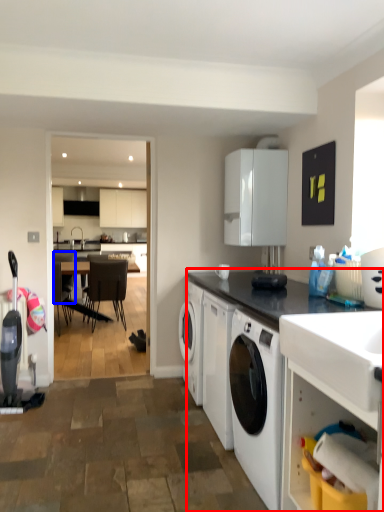
Question: Which object appears farthest to the camera in this image, countertop (highlighted by a red box) or chair (highlighted by a blue box)?

Choices:
 (A) countertop
 (B) chair

Answer: (B)